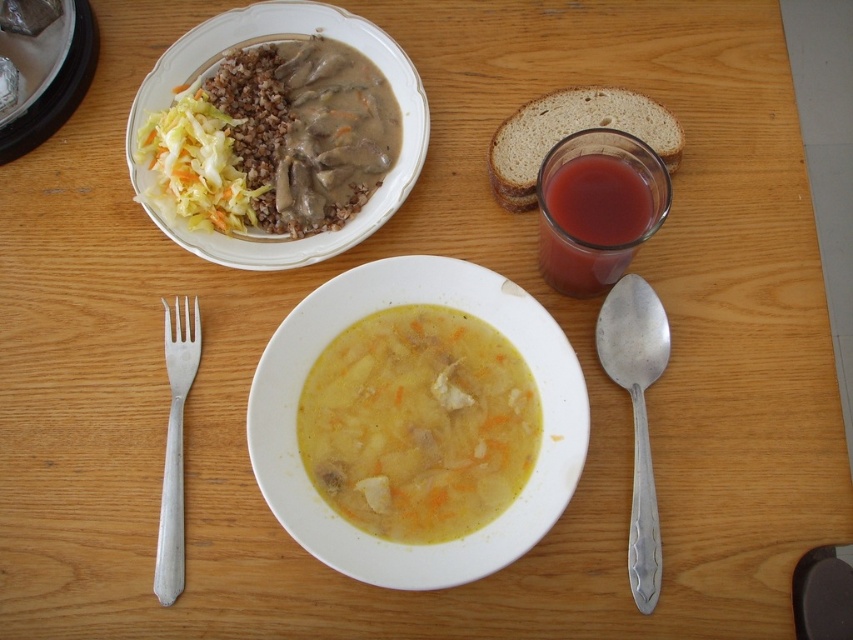
You are a guest at a dinner and need to use either the silver metallic spoon at right or the silver metallic fork at lower left. Which one is closer to your right hand if you are sitting facing the table?

The silver metallic spoon at right is positioned on the right side of the silver metallic fork at lower left, so the spoon is closer to your right hand.

You are a diner who wants to pick up the silver metallic spoon at right and the silver metallic fork at lower left. Which one will you reach first if you are sitting at the table?

You will reach the silver metallic spoon at right first because it is closer to you than the silver metallic fork at lower left.